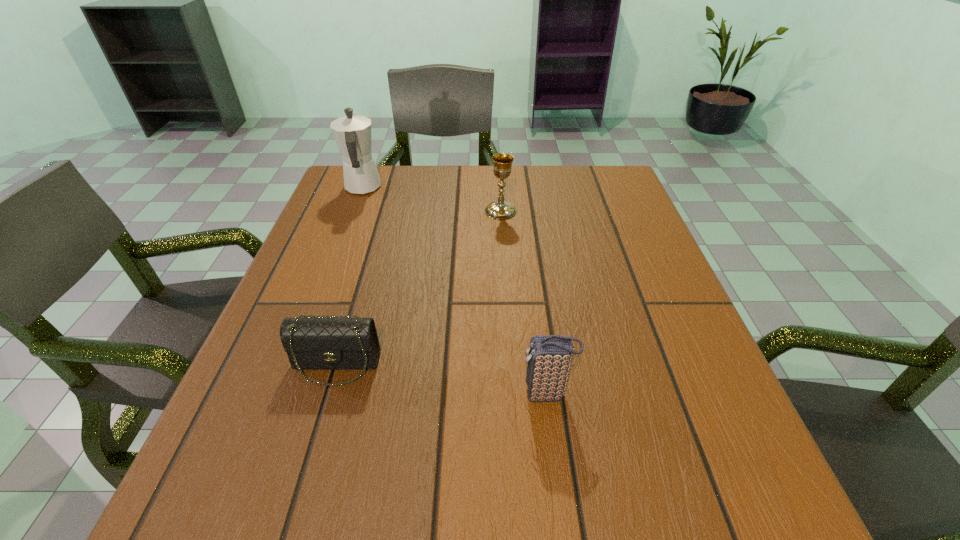
Where is `vacant region between the tallest object and the left clutch bag`? The height and width of the screenshot is (540, 960). vacant region between the tallest object and the left clutch bag is located at coordinates [349, 276].

Where is `vacant region between the tallest object and the taller clutch bag`? Image resolution: width=960 pixels, height=540 pixels. vacant region between the tallest object and the taller clutch bag is located at coordinates (455, 291).

Point out which object is positioned as the nearest to the chalice. Please provide its 2D coordinates. Your answer should be formatted as a tuple, i.e. [(x, y)], where the tuple contains the x and y coordinates of a point satisfying the conditions above.

[(352, 133)]

You are a GUI agent. You are given a task and a screenshot of the screen. Output one action in this format:
    pyautogui.click(x=<x>, y=<y>)
    Task: Click on the object that is the third closest to the chalice
    Image resolution: width=960 pixels, height=540 pixels.
    Given the screenshot: What is the action you would take?
    pyautogui.click(x=549, y=361)

Find the location of `free spot that satisfies the following two spatial constraints: 1. on the front side of the chalice; 2. on the right side of the tallest object`. free spot that satisfies the following two spatial constraints: 1. on the front side of the chalice; 2. on the right side of the tallest object is located at coordinates (353, 211).

Identify the location of vacant space that satisfies the following two spatial constraints: 1. on the front side of the chalice; 2. on the right side of the tallest object. This screenshot has width=960, height=540. (353, 211).